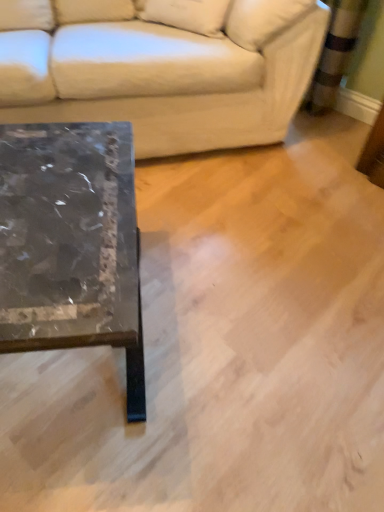
Question: From their relative heights in the image, would you say white leather couch at upper left is taller or shorter than marble/black at left?

Choices:
 (A) short
 (B) tall

Answer: (B)

Question: In the image, is white leather couch at upper left positioned in front of or behind marble/black at left?

Choices:
 (A) behind
 (B) front

Answer: (A)

Question: Considering the real-world distances, which object is farthest from the marble/black at left?

Choices:
 (A) white leather couch at upper left
 (B) beige fabric pillow at upper center

Answer: (B)

Question: Which object is positioned closest to the beige fabric pillow at upper center?

Choices:
 (A) white leather couch at upper left
 (B) marble/black at left

Answer: (A)